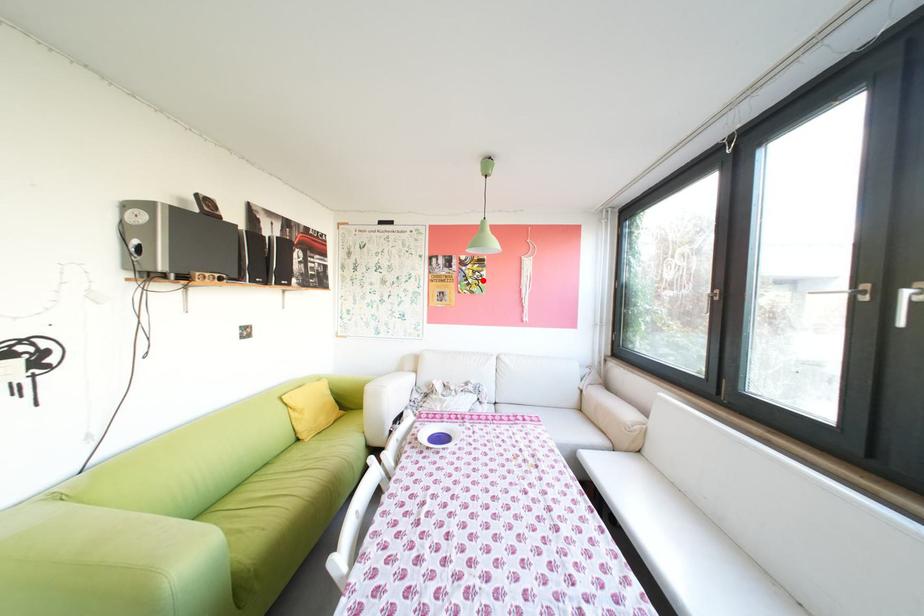
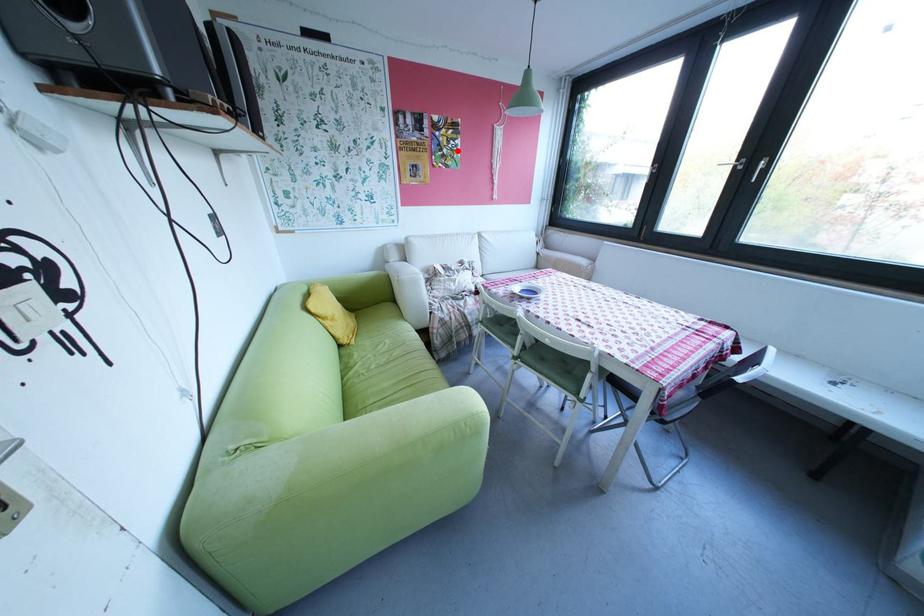
I am providing you with two images of the same scene from different viewpoints. A red point is marked on the first image and another point is marked on the second image. Do the highlighted points in image1 and image2 indicate the same real-world spot?

Yes